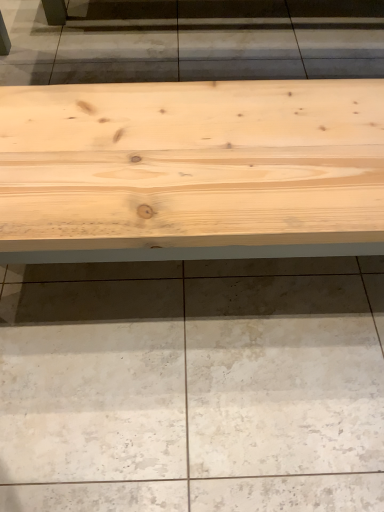
What do you see at coordinates (192, 385) in the screenshot?
I see `natural wood bench at center` at bounding box center [192, 385].

Locate an element on the screen. The image size is (384, 512). natural wood bench at center is located at coordinates [x=192, y=385].

What do you see at coordinates (191, 164) in the screenshot? The height and width of the screenshot is (512, 384). I see `natural wood table at center` at bounding box center [191, 164].

The width and height of the screenshot is (384, 512). What are the coordinates of `natural wood table at center` in the screenshot? It's located at (191, 164).

The image size is (384, 512). I want to click on natural wood bench at center, so click(192, 385).

Based on their positions, is natural wood bench at center located to the left or right of natural wood table at center?

natural wood bench at center is to the right of natural wood table at center.

Considering their positions, is natural wood bench at center located in front of or behind natural wood table at center?

Clearly, natural wood bench at center is behind natural wood table at center.

Considering the positions of points (267, 273) and (149, 184), is point (267, 273) farther from camera compared to point (149, 184)?

Yes, it is behind point (149, 184).

From the image's perspective, which one is positioned higher, natural wood bench at center or natural wood table at center?

From the image's view, natural wood table at center is above.

From a real-world perspective, is natural wood bench at center above or below natural wood table at center?

From a real-world perspective, natural wood bench at center is physically below natural wood table at center.

Between natural wood bench at center and natural wood table at center, which one has smaller width?

natural wood bench at center is thinner.

Considering the sizes of natural wood bench at center and natural wood table at center in the image, is natural wood bench at center taller or shorter than natural wood table at center?

In the image, natural wood bench at center appears to be shorter than natural wood table at center.

Considering the sizes of natural wood bench at center and natural wood table at center in the image, is natural wood bench at center bigger or smaller than natural wood table at center?

Considering their sizes, natural wood bench at center takes up less space than natural wood table at center.

Is natural wood bench at center inside the boundaries of natural wood table at center, or outside?

natural wood bench at center is located beyond the bounds of natural wood table at center.

From the picture: Are natural wood bench at center and natural wood table at center far apart?

natural wood bench at center is actually quite close to natural wood table at center.

Could you tell me if natural wood bench at center is facing natural wood table at center?

No, natural wood bench at center is not turned towards natural wood table at center.

From the picture: How different are the orientations of natural wood bench at center and natural wood table at center in degrees?

There is a 179-degree angle between the facing directions of natural wood bench at center and natural wood table at center.

You are a GUI agent. You are given a task and a screenshot of the screen. Output one action in this format:
    pyautogui.click(x=<x>, y=<y>)
    Task: Click on the table that is above the natural wood bench at center (from a real-world perspective)
    This screenshot has width=384, height=512.
    Given the screenshot: What is the action you would take?
    [191, 164]

In the scene shown: Between natural wood table at center and natural wood bench at center, which one appears on the left side from the viewer's perspective?

natural wood table at center is more to the left.

Between natural wood table at center and natural wood bench at center, which one is positioned in front?

natural wood table at center is closer to the camera.

Does point (296, 232) lie in front of point (122, 310)?

Yes.

From the image's perspective, is natural wood table at center on natural wood bench at center?

Yes, from the image's perspective, natural wood table at center is over natural wood bench at center.

From a real-world perspective, is natural wood table at center below natural wood bench at center?

No, from a real-world perspective, natural wood table at center is not below natural wood bench at center.

Between natural wood table at center and natural wood bench at center, which one has smaller width?

Thinner between the two is natural wood bench at center.

Considering the relative sizes of natural wood table at center and natural wood bench at center in the image provided, is natural wood table at center taller than natural wood bench at center?

Correct, natural wood table at center is much taller as natural wood bench at center.

Between natural wood table at center and natural wood bench at center, which one has smaller size?

Smaller between the two is natural wood bench at center.

Would you say natural wood table at center is inside or outside natural wood bench at center?

natural wood table at center lies outside natural wood bench at center.

Is natural wood table at center next to natural wood bench at center?

No.

Is natural wood table at center positioned with its back to natural wood bench at center?

No, natural wood table at center is not facing away from natural wood bench at center.

Find the location of `concrete below the natural wood table at center (from a real-world perspective)`. concrete below the natural wood table at center (from a real-world perspective) is located at coordinates (192, 385).

Identify the location of concrete behind the natural wood table at center. The height and width of the screenshot is (512, 384). (192, 385).

This screenshot has height=512, width=384. I want to click on table that is on the left side of natural wood bench at center, so click(191, 164).